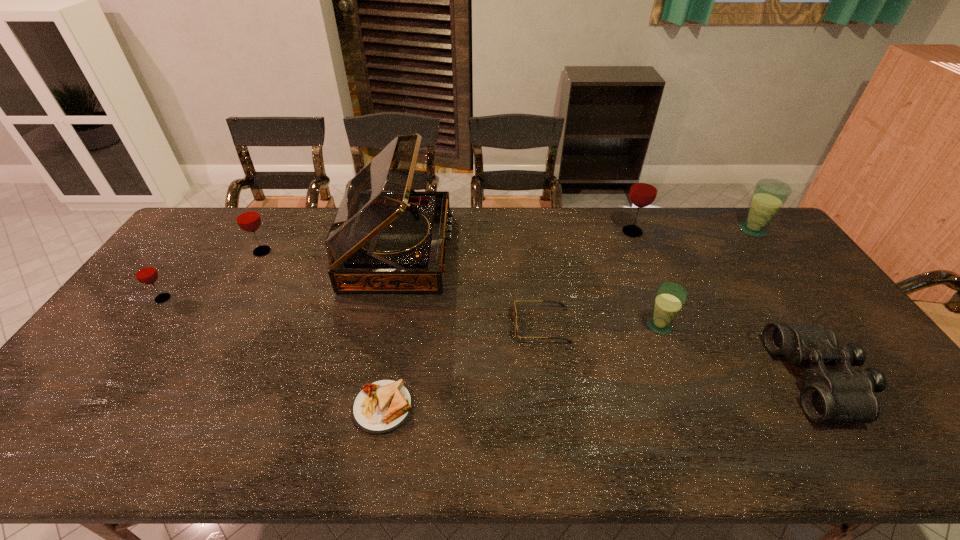
Where is `free point located on the left of the second glass from left to right`? The height and width of the screenshot is (540, 960). free point located on the left of the second glass from left to right is located at coordinates (225, 252).

In order to click on vacant space located 0.260m on the front of the fourth farthest glass in this screenshot , I will do `click(104, 380)`.

At what (x,y) coordinates should I click in order to perform the action: click on vacant region located on the front of the nearer blue glass. Please return your answer as a coordinate pair (x, y). Looking at the image, I should click on (704, 440).

At what (x,y) coordinates should I click in order to perform the action: click on free location located 0.240m at the eyepieces of the black binoculars. Please return your answer as a coordinate pair (x, y). The width and height of the screenshot is (960, 540). Looking at the image, I should click on (688, 379).

Where is `vacant space situated at the eyepieces of the black binoculars`? The width and height of the screenshot is (960, 540). vacant space situated at the eyepieces of the black binoculars is located at coordinates (763, 379).

In order to click on free space located at the eyepieces of the black binoculars in this screenshot , I will do `click(744, 379)`.

Where is `vacant area situated on the front-facing side of the fifth object from right to left`? vacant area situated on the front-facing side of the fifth object from right to left is located at coordinates (490, 325).

At what (x,y) coordinates should I click in order to perform the action: click on free spot located on the front-facing side of the fifth object from right to left. Please return your answer as a coordinate pair (x, y). Looking at the image, I should click on (433, 325).

Image resolution: width=960 pixels, height=540 pixels. I want to click on vacant region located 0.060m on the front-facing side of the fifth object from right to left, so click(x=493, y=325).

Find the location of a particular element. This screenshot has height=540, width=960. vacant area situated 0.140m on the left of the shortest object is located at coordinates (295, 407).